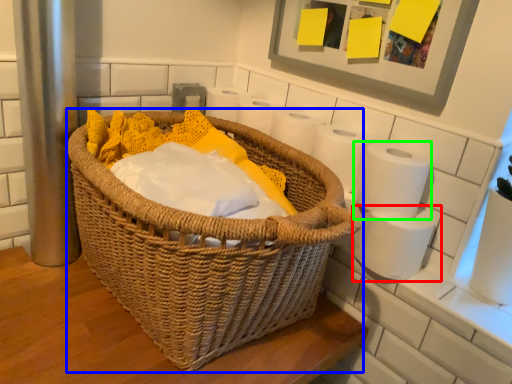
Question: Which object is positioned farthest from toilet paper (highlighted by a red box)? Select from picnic basket (highlighted by a blue box) and toilet paper (highlighted by a green box).

Choices:
 (A) picnic basket
 (B) toilet paper

Answer: (A)